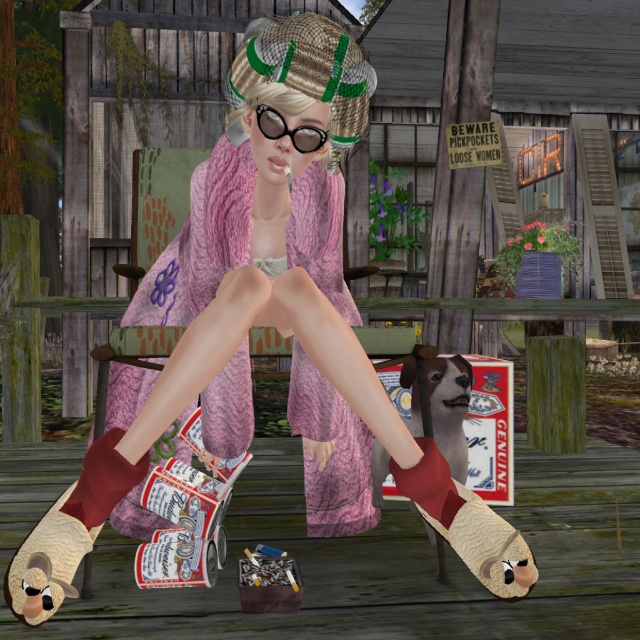
Question: Does pink knitted dress at center have a larger size compared to beige suede shoe at lower left?

Choices:
 (A) no
 (B) yes

Answer: (B)

Question: Which object appears farthest from the camera in this image?

Choices:
 (A) pink knitted dress at center
 (B) leather/textured shoe at lower center

Answer: (A)

Question: Can you confirm if beige suede shoe at lower left is positioned above burgundy knitted sock at lower left?

Choices:
 (A) yes
 (B) no

Answer: (B)

Question: Estimate the real-world distances between objects in this image. Which object is closer to the beige suede shoe at lower left?

Choices:
 (A) leather/textured shoe at lower center
 (B) pink knitted dress at center
 (C) burgundy knitted sock at lower left

Answer: (C)

Question: Is pink knitted dress at center positioned behind burgundy knitted sock at lower left?

Choices:
 (A) no
 (B) yes

Answer: (B)

Question: Estimate the real-world distances between objects in this image. Which object is closer to the burgundy knitted sock at lower left?

Choices:
 (A) beige suede shoe at lower left
 (B) leather/textured shoe at lower center
 (C) pink knitted dress at center

Answer: (A)